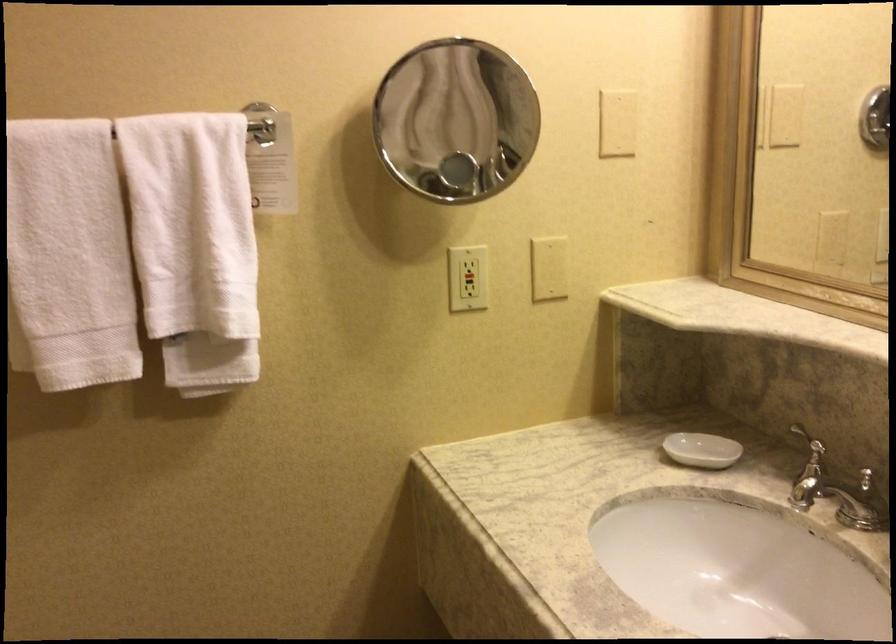
What do you see at coordinates (467, 278) in the screenshot?
I see `the red outlet button` at bounding box center [467, 278].